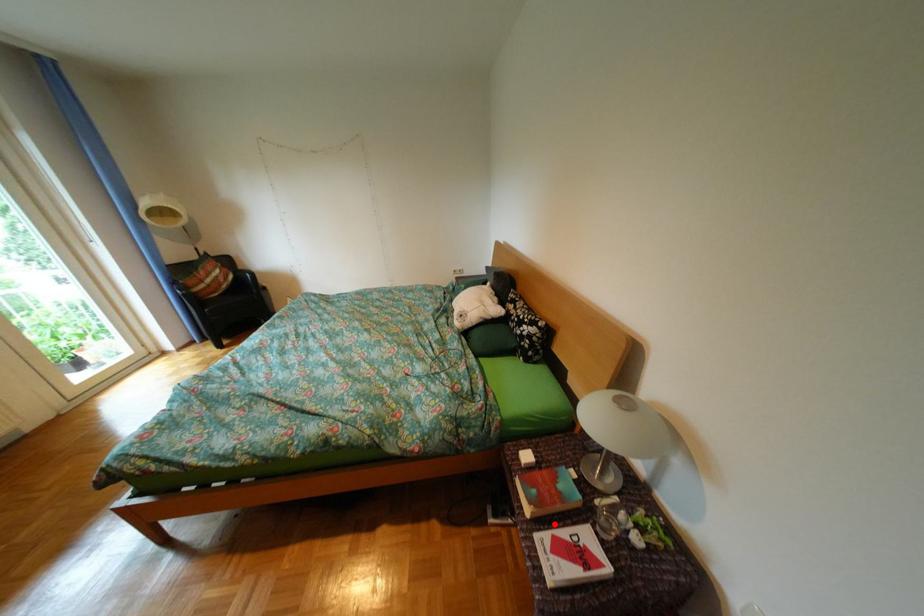
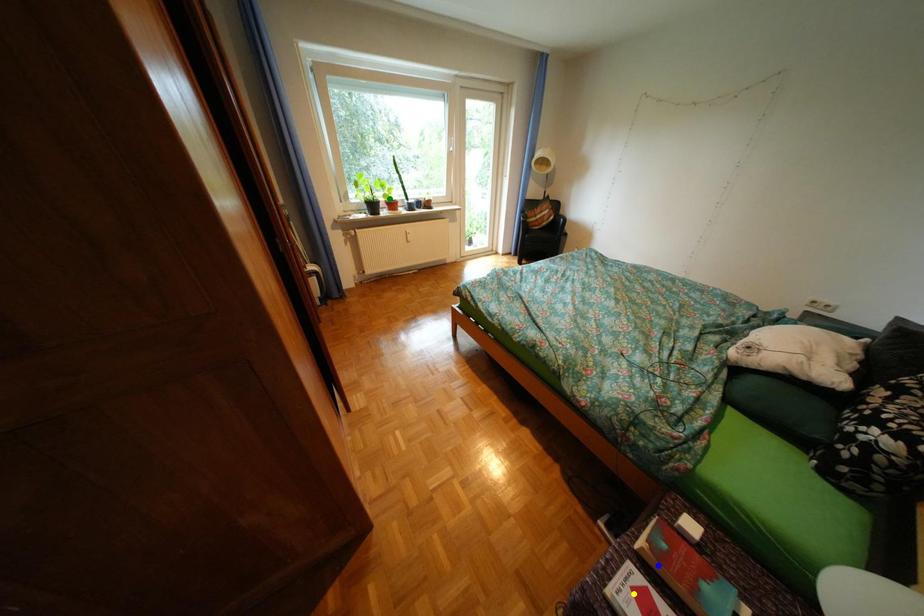
Question: I am providing you with two images of the same scene from different viewpoints. A red point is marked on the first image. You are given multiple points on the second image. In image 2, which mark is for the same physical point as the one in image 1?

Choices:
 (A) green point
 (B) yellow point
 (C) blue point

Answer: (C)